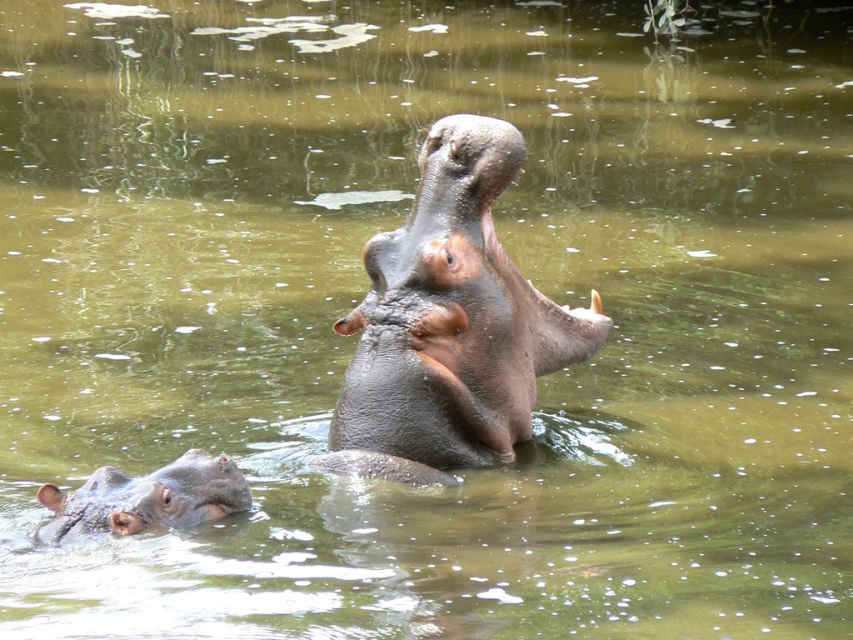
Question: Which object is farther from the camera taking this photo?

Choices:
 (A) gray matte hippo at lower left
 (B) dark gray textured hippo at center

Answer: (B)

Question: Is dark gray textured hippo at center smaller than gray matte hippo at lower left?

Choices:
 (A) no
 (B) yes

Answer: (A)

Question: Which point is closer to the camera taking this photo?

Choices:
 (A) (506, 381)
 (B) (57, 515)

Answer: (B)

Question: Does dark gray textured hippo at center appear on the right side of gray matte hippo at lower left?

Choices:
 (A) yes
 (B) no

Answer: (A)

Question: Can you confirm if dark gray textured hippo at center is bigger than gray matte hippo at lower left?

Choices:
 (A) no
 (B) yes

Answer: (B)